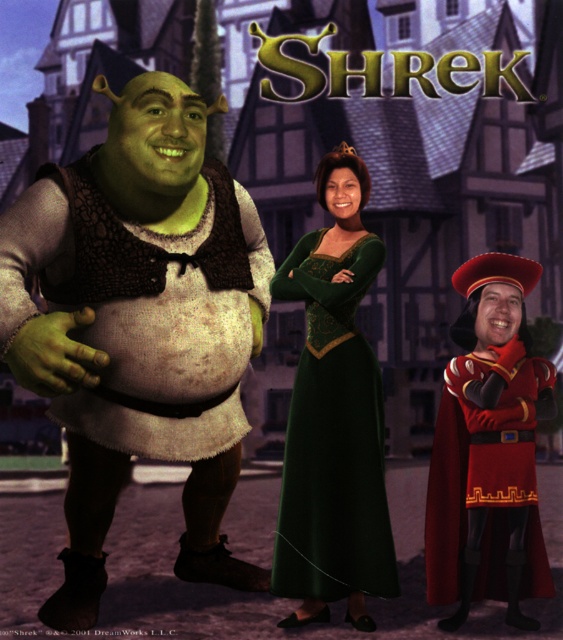
In the promotional poster for the animated film Shrek, you see the characters Shrek wearing a brown textured vest at left and Fiona in a green velvet dress at center. Which clothing item is positioned more to the left?

The brown textured vest at left is positioned more to the left than the green velvet dress at center.

From the picture: You are a movie prop designer working on the promotional poster for Shrek. You need to ensure the brown textured vest at left is visible to viewers. Given that the vest is 4.73 meters away from the camera, is it within the optimal viewing distance for clarity?

The brown textured vest at left is 4.73 meters from the camera, which is within the optimal viewing distance for clarity, so it should be visible to viewers.

In the promotional poster for the animated film Shrek, you see the characters Shrek wearing a brown textured vest at left and Lord Farquaad wearing shiny red armor at right. Which character is wearing clothing that is shorter in height?

The brown textured vest at left is shorter than the shiny red armor at right, so Shrek is wearing clothing that is shorter in height.